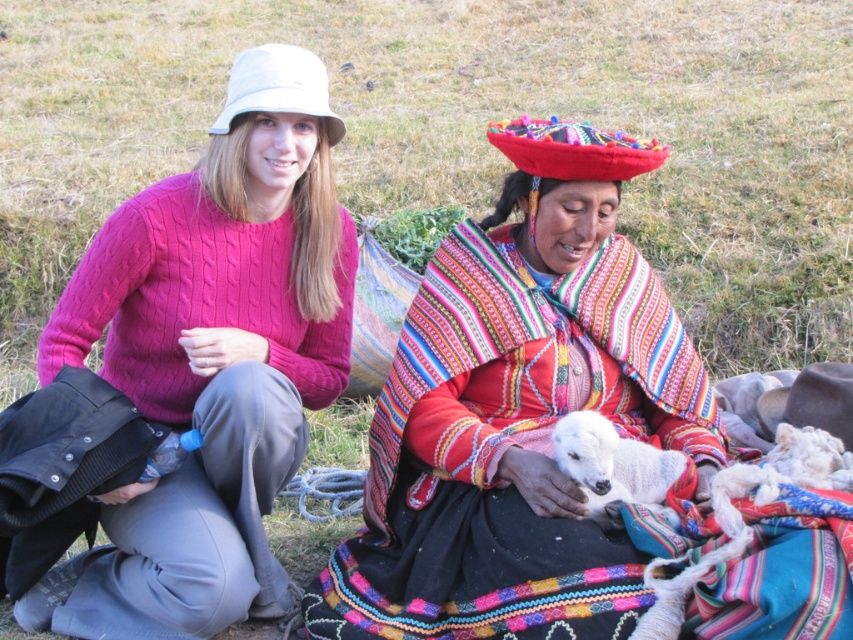
Question: Based on their relative distances, which object is nearer to the multicolored woven shawl at center?

Choices:
 (A) white woolen lamb at center
 (B) cable-knit sweater at left

Answer: (A)

Question: Which point is closer to the camera taking this photo?

Choices:
 (A) (618, 508)
 (B) (352, 557)
 (C) (231, 422)

Answer: (A)

Question: Which object is closer to the camera taking this photo?

Choices:
 (A) multicolored woven shawl at center
 (B) white woolen lamb at center
 (C) cable-knit sweater at left

Answer: (A)

Question: In this image, where is multicolored woven shawl at center located relative to white woolen lamb at center?

Choices:
 (A) below
 (B) above

Answer: (B)

Question: Is the position of multicolored woven shawl at center more distant than that of white woolen lamb at center?

Choices:
 (A) no
 (B) yes

Answer: (A)

Question: Does multicolored woven shawl at center have a lesser width compared to cable-knit sweater at left?

Choices:
 (A) no
 (B) yes

Answer: (A)